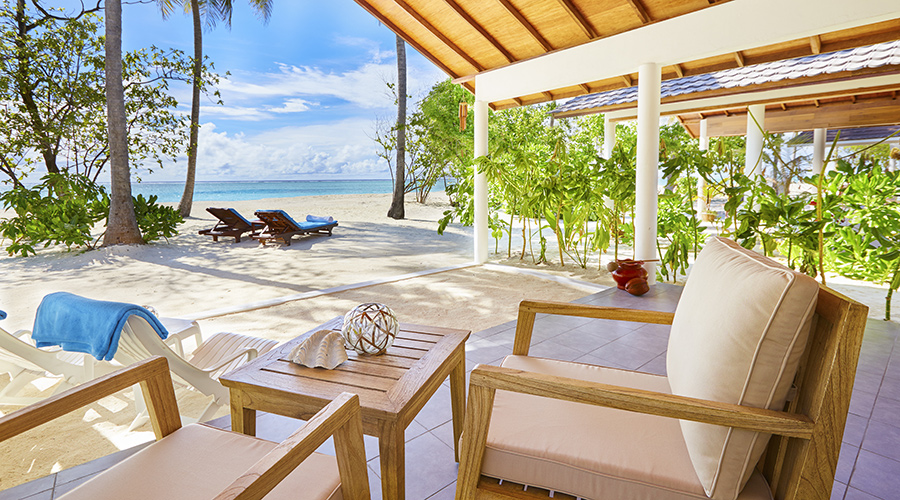
You are a GUI agent. You are given a task and a screenshot of the screen. Output one action in this format:
    pyautogui.click(x=<x>, y=<y>)
    Task: Click on the cushions
    This screenshot has height=500, width=900.
    Given the screenshot: What is the action you would take?
    pyautogui.click(x=735, y=348), pyautogui.click(x=304, y=224), pyautogui.click(x=232, y=212)